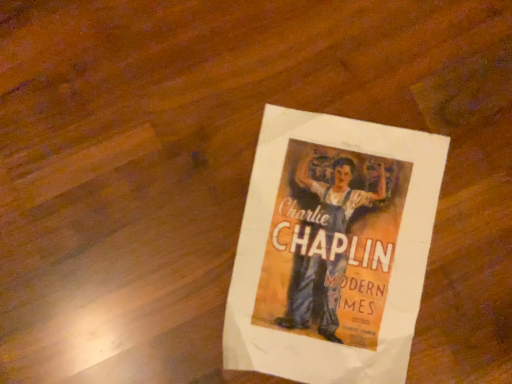
Identify the location of matte paper poster at center. (332, 249).

What do you see at coordinates (332, 249) in the screenshot? I see `matte paper poster at center` at bounding box center [332, 249].

Consider the image. In order to face matte paper poster at center, should I rotate leftwards or rightwards?

To face it directly, rotate right by 9.963 degrees.

In order to click on matte paper poster at center in this screenshot , I will do `click(332, 249)`.